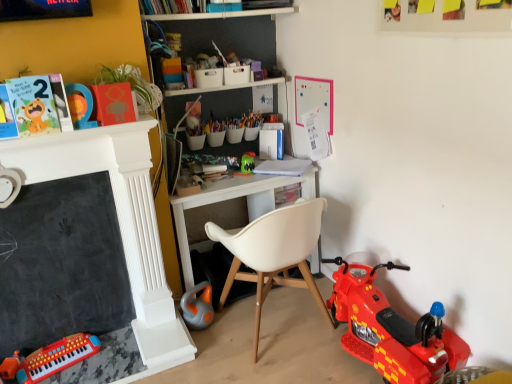
You are a GUI agent. You are given a task and a screenshot of the screen. Output one action in this format:
    pyautogui.click(x=<x>, y=<y>)
    Task: Click on the free point to the right of orange plastic toy at lower center, which ranks as the 3th toy in right-to-left order
    The image size is (512, 384).
    Given the screenshot: What is the action you would take?
    pyautogui.click(x=234, y=321)